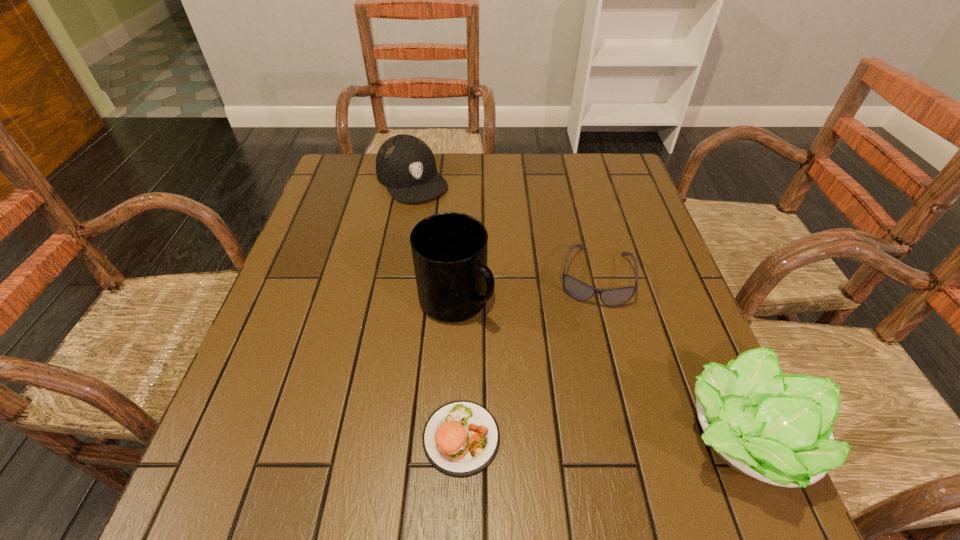
Where is `free location located 0.090m on the lenses of the second shortest object`? This screenshot has height=540, width=960. free location located 0.090m on the lenses of the second shortest object is located at coordinates (589, 341).

At what (x,y) coordinates should I click in order to perform the action: click on free space located 0.270m on the lenses of the second shortest object. Please return your answer as a coordinate pair (x, y). Looking at the image, I should click on (581, 422).

Find the location of a particular element. This screenshot has height=540, width=960. vacant position located 0.170m on the lenses of the second shortest object is located at coordinates (587, 374).

Identify the location of vacant area located on the front-facing side of the cap. (441, 223).

Where is `free space located 0.390m on the front-facing side of the cap`? This screenshot has width=960, height=540. free space located 0.390m on the front-facing side of the cap is located at coordinates (493, 296).

Identify the location of vacant space situated 0.160m on the front-facing side of the cap. (450, 236).

Locate an element on the screen. The image size is (960, 540). object present at the far edge is located at coordinates [406, 165].

Identify the location of patty located at the near edge. The width and height of the screenshot is (960, 540). (460, 438).

I want to click on lettuce located in the near edge section of the desktop, so click(x=777, y=429).

Find the location of `object that is at the left edge`. object that is at the left edge is located at coordinates 406,165.